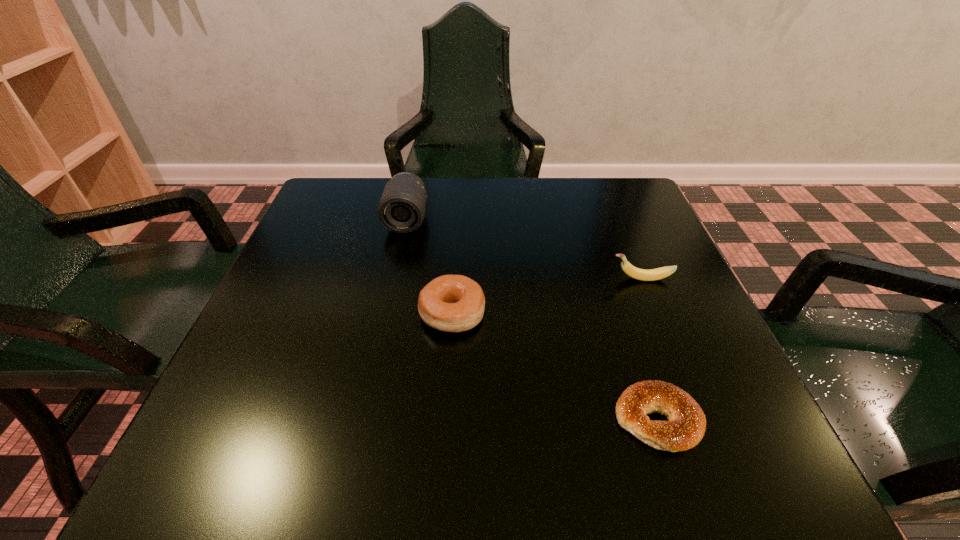
The width and height of the screenshot is (960, 540). Find the location of `the leftmost object`. the leftmost object is located at coordinates (401, 209).

The image size is (960, 540). In order to click on the tallest object in this screenshot , I will do `click(401, 209)`.

Image resolution: width=960 pixels, height=540 pixels. What are the coordinates of `the second farthest object` in the screenshot? It's located at (659, 273).

Identify the location of the left bagel. (452, 303).

This screenshot has width=960, height=540. Find the location of `the second nearest object`. the second nearest object is located at coordinates (452, 303).

This screenshot has height=540, width=960. I want to click on the shorter bagel, so click(x=686, y=426).

In order to click on the shortest object in this screenshot , I will do `click(686, 426)`.

Where is `free space located on the surface of the leftmost object`? The width and height of the screenshot is (960, 540). free space located on the surface of the leftmost object is located at coordinates pos(385,316).

Where is `free space located 0.160m at the stem of the banana`? The height and width of the screenshot is (540, 960). free space located 0.160m at the stem of the banana is located at coordinates (531, 279).

This screenshot has width=960, height=540. What are the coordinates of `blank space located 0.180m at the stem of the banana` in the screenshot? It's located at 520,279.